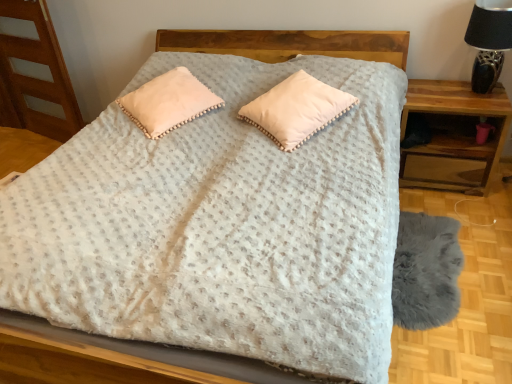
Question: Does wooden nightstand at right have a greater width compared to peach velvety pillow at center, positioned as the 1th pillow in left-to-right order?

Choices:
 (A) no
 (B) yes

Answer: (A)

Question: Considering the relative positions of wooden nightstand at right and peach velvety pillow at center, positioned as the 2th pillow in right-to-left order, in the image provided, is wooden nightstand at right to the right of peach velvety pillow at center, positioned as the 2th pillow in right-to-left order, from the viewer's perspective?

Choices:
 (A) no
 (B) yes

Answer: (B)

Question: From the image's perspective, is wooden nightstand at right located beneath peach velvety pillow at center, positioned as the 2th pillow in right-to-left order?

Choices:
 (A) yes
 (B) no

Answer: (A)

Question: Considering the relative positions of wooden nightstand at right and peach velvety pillow at center, positioned as the 1th pillow in left-to-right order, in the image provided, is wooden nightstand at right in front of peach velvety pillow at center, positioned as the 1th pillow in left-to-right order,?

Choices:
 (A) no
 (B) yes

Answer: (A)

Question: Is wooden nightstand at right completely or partially outside of peach velvety pillow at center, positioned as the 2th pillow in right-to-left order?

Choices:
 (A) no
 (B) yes

Answer: (B)

Question: Considering the positions of peach velvety pillow at center, positioned as the 2th pillow in right-to-left order, and pom-pom trim pillow at center, acting as the first pillow starting from the right, in the image, is peach velvety pillow at center, positioned as the 2th pillow in right-to-left order, wider or thinner than pom-pom trim pillow at center, acting as the first pillow starting from the right,?

Choices:
 (A) thin
 (B) wide

Answer: (A)

Question: In terms of height, does peach velvety pillow at center, positioned as the 2th pillow in right-to-left order, look taller or shorter compared to pom-pom trim pillow at center, acting as the first pillow starting from the right?

Choices:
 (A) short
 (B) tall

Answer: (A)

Question: From the image's perspective, is peach velvety pillow at center, positioned as the 1th pillow in left-to-right order, above or below pom-pom trim pillow at center, arranged as the second pillow when viewed from the left?

Choices:
 (A) below
 (B) above

Answer: (B)

Question: Do you think peach velvety pillow at center, positioned as the 2th pillow in right-to-left order, is within pom-pom trim pillow at center, arranged as the second pillow when viewed from the left, or outside of it?

Choices:
 (A) outside
 (B) inside

Answer: (A)

Question: Is wooden nightstand at right spatially inside gray fluffy rug at lower right, or outside of it?

Choices:
 (A) outside
 (B) inside

Answer: (A)

Question: From the image's perspective, is wooden nightstand at right located above or below gray fluffy rug at lower right?

Choices:
 (A) above
 (B) below

Answer: (A)

Question: In the image, is wooden nightstand at right positioned in front of or behind gray fluffy rug at lower right?

Choices:
 (A) behind
 (B) front

Answer: (A)

Question: Does point (402, 185) appear closer or farther from the camera than point (441, 241)?

Choices:
 (A) farther
 (B) closer

Answer: (A)

Question: Relative to wooden nightstand at right, is peach velvety pillow at center, positioned as the 2th pillow in right-to-left order, in front or behind?

Choices:
 (A) behind
 (B) front

Answer: (B)

Question: Looking at their shapes, would you say peach velvety pillow at center, positioned as the 2th pillow in right-to-left order, is wider or thinner than wooden nightstand at right?

Choices:
 (A) wide
 (B) thin

Answer: (A)